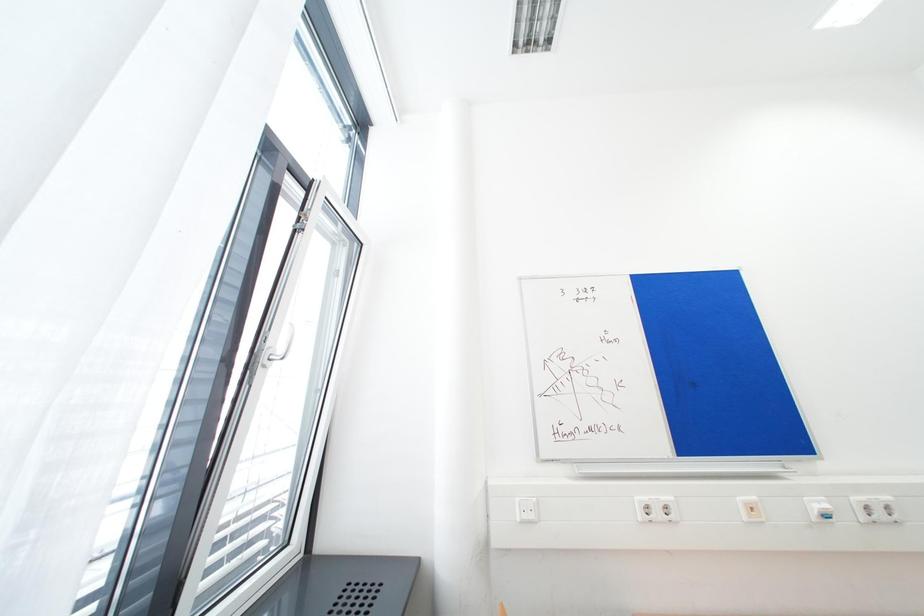
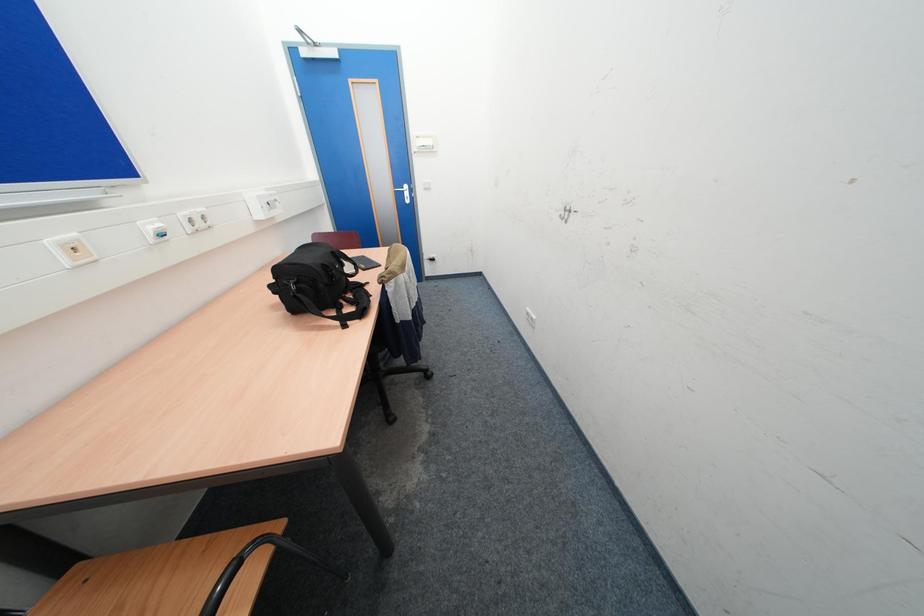
How did the camera likely rotate?

The camera rotated toward right-down.